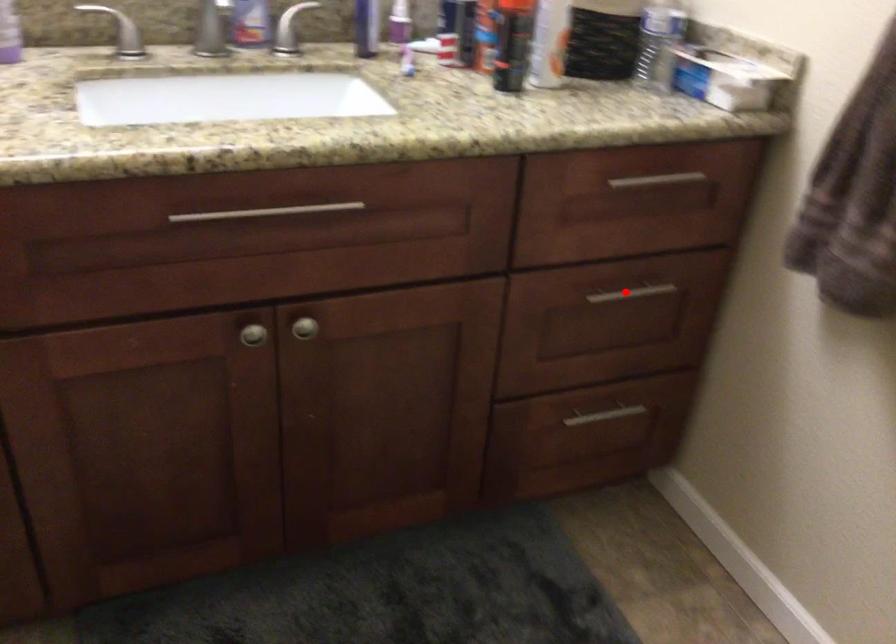
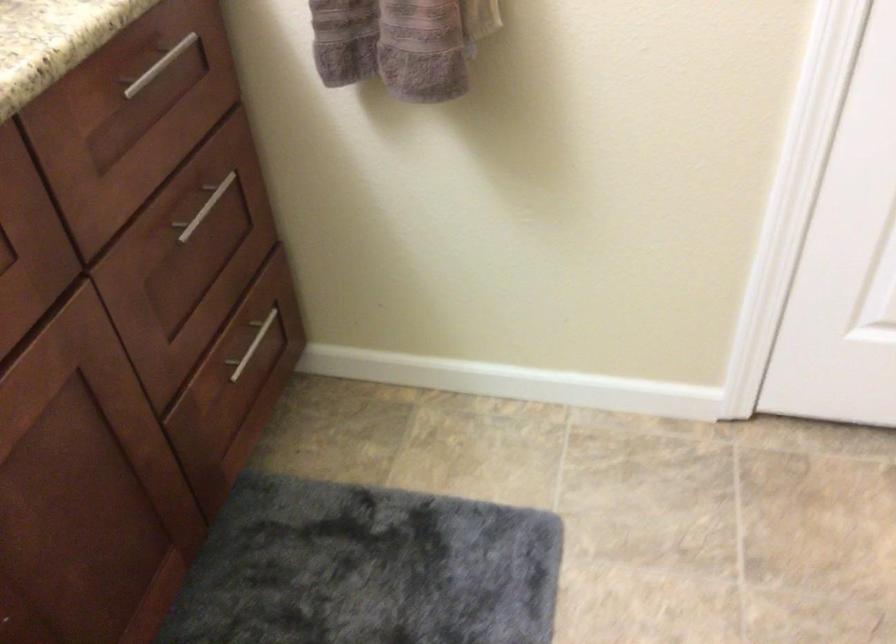
Question: A red point is marked in image1. In image2, is the corresponding 3D point closer to the camera or farther? Reply with the corresponding letter.

Choices:
 (A) The corresponding 3D point is closer.
 (B) The corresponding 3D point is farther.

Answer: (A)